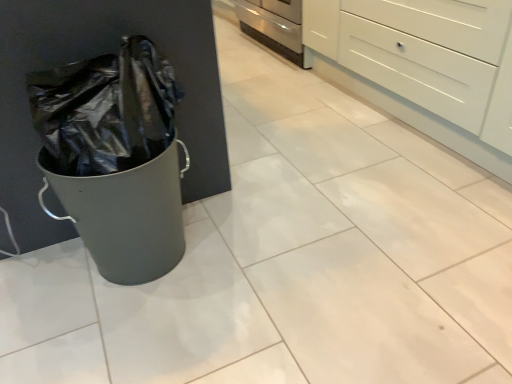
What is the approximate width of white glossy chest of drawers at upper right?

white glossy chest of drawers at upper right is 52.42 centimeters wide.

Image resolution: width=512 pixels, height=384 pixels. I want to click on white glossy chest of drawers at upper right, so tap(426, 65).

What do you see at coordinates (426, 65) in the screenshot? The height and width of the screenshot is (384, 512). I see `white glossy chest of drawers at upper right` at bounding box center [426, 65].

What is the approximate height of white glossy chest of drawers at upper right?

The height of white glossy chest of drawers at upper right is 26.48 inches.

Describe the element at coordinates (274, 26) in the screenshot. I see `stainless steel oven at center` at that location.

Image resolution: width=512 pixels, height=384 pixels. What are the coordinates of `stainless steel oven at center` in the screenshot? It's located at (274, 26).

Locate an element on the screen. white glossy chest of drawers at upper right is located at coordinates (426, 65).

Which object is positioned more to the left, white glossy chest of drawers at upper right or stainless steel oven at center?

stainless steel oven at center is more to the left.

Considering the relative positions of white glossy chest of drawers at upper right and stainless steel oven at center in the image provided, is white glossy chest of drawers at upper right behind stainless steel oven at center?

No, the depth of white glossy chest of drawers at upper right is less than that of stainless steel oven at center.

Which is closer, (372, 24) or (249, 18)?

Point (372, 24)

From the image's perspective, which is above, white glossy chest of drawers at upper right or stainless steel oven at center?

stainless steel oven at center appears higher in the image.

From a real-world perspective, between white glossy chest of drawers at upper right and stainless steel oven at center, who is vertically lower?

stainless steel oven at center.

Which object is thinner, white glossy chest of drawers at upper right or stainless steel oven at center?

Thinner between the two is white glossy chest of drawers at upper right.

Considering the relative sizes of white glossy chest of drawers at upper right and stainless steel oven at center in the image provided, is white glossy chest of drawers at upper right taller than stainless steel oven at center?

Indeed, white glossy chest of drawers at upper right has a greater height compared to stainless steel oven at center.

Does white glossy chest of drawers at upper right have a smaller size compared to stainless steel oven at center?

Actually, white glossy chest of drawers at upper right might be larger than stainless steel oven at center.

Is white glossy chest of drawers at upper right positioned beyond the bounds of stainless steel oven at center?

Indeed, white glossy chest of drawers at upper right is completely outside stainless steel oven at center.

Is white glossy chest of drawers at upper right with stainless steel oven at center?

They are not placed beside each other.

Is white glossy chest of drawers at upper right oriented towards stainless steel oven at center?

No, white glossy chest of drawers at upper right does not turn towards stainless steel oven at center.

What's the angular difference between white glossy chest of drawers at upper right and stainless steel oven at center's facing directions?

They differ by 3.68e-05 degrees in their facing directions.

There is a stainless steel oven at center. Identify the location of the chest of drawers above it (from a real-world perspective). (426, 65).

Can you confirm if stainless steel oven at center is positioned to the right of white glossy chest of drawers at upper right?

Incorrect, stainless steel oven at center is not on the right side of white glossy chest of drawers at upper right.

Is stainless steel oven at center in front of or behind white glossy chest of drawers at upper right in the image?

Result: stainless steel oven at center is positioned farther from the viewer than white glossy chest of drawers at upper right.

Between point (286, 51) and point (397, 7), which one is positioned behind?

The point (286, 51) is more distant.

In the scene shown: From the image's perspective, is stainless steel oven at center located above or below white glossy chest of drawers at upper right?

stainless steel oven at center is above white glossy chest of drawers at upper right.

From a real-world perspective, who is located lower, stainless steel oven at center or white glossy chest of drawers at upper right?

stainless steel oven at center.

Which object is wider, stainless steel oven at center or white glossy chest of drawers at upper right?

stainless steel oven at center is wider.

Who is shorter, stainless steel oven at center or white glossy chest of drawers at upper right?

With less height is stainless steel oven at center.

Considering the relative sizes of stainless steel oven at center and white glossy chest of drawers at upper right in the image provided, is stainless steel oven at center bigger than white glossy chest of drawers at upper right?

No.

Would you say stainless steel oven at center is outside white glossy chest of drawers at upper right?

stainless steel oven at center is positioned outside white glossy chest of drawers at upper right.

Would you say stainless steel oven at center is a long distance from white glossy chest of drawers at upper right?

That's not correct — stainless steel oven at center is a little close to white glossy chest of drawers at upper right.

Is stainless steel oven at center facing away from white glossy chest of drawers at upper right?

No, stainless steel oven at center is not facing the opposite direction of white glossy chest of drawers at upper right.

Locate an element on the screen. The height and width of the screenshot is (384, 512). the chest of drawers located in front of the stainless steel oven at center is located at coordinates (426, 65).

You are a GUI agent. You are given a task and a screenshot of the screen. Output one action in this format:
    pyautogui.click(x=<x>, y=<y>)
    Task: Click on the chest of drawers to the right of stainless steel oven at center
    
    Given the screenshot: What is the action you would take?
    pyautogui.click(x=426, y=65)

You are a GUI agent. You are given a task and a screenshot of the screen. Output one action in this format:
    pyautogui.click(x=<x>, y=<y>)
    Task: Click on the oven beneath the white glossy chest of drawers at upper right (from a real-world perspective)
    Image resolution: width=512 pixels, height=384 pixels.
    Given the screenshot: What is the action you would take?
    pyautogui.click(x=274, y=26)